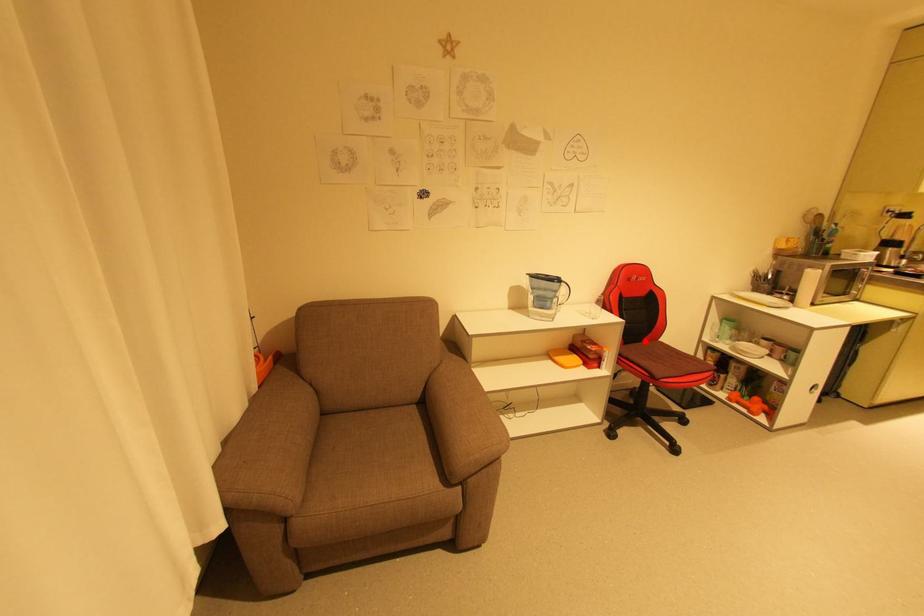
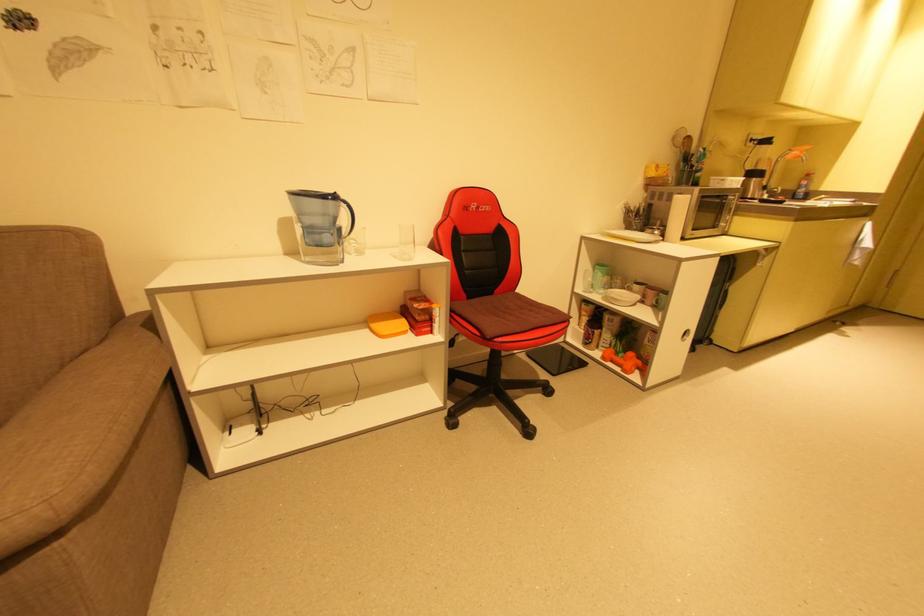
Question: I am providing you with two images of the same scene from different viewpoints. A red point is shown in image1. For the corresponding object point in image2, is it positioned nearer or farther from the camera?

Choices:
 (A) Nearer
 (B) Farther

Answer: (A)